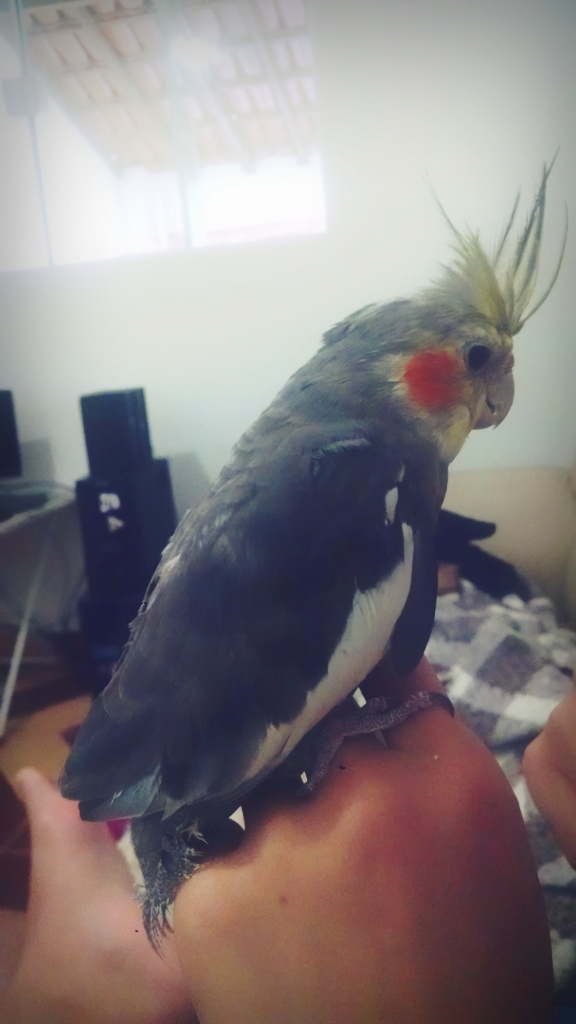
The width and height of the screenshot is (576, 1024). Identify the location of stereo system. (111, 410), (122, 513).